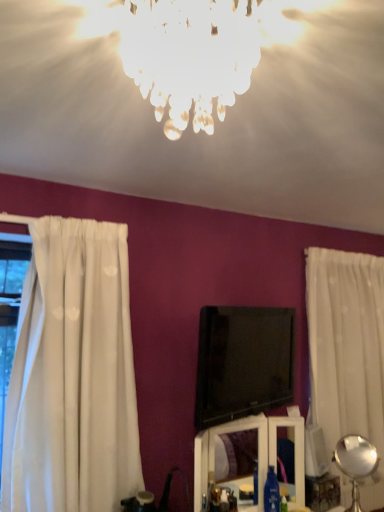
Question: From the image's perspective, would you say white glossy vanity at lower center is shown under white sheer curtain at right?

Choices:
 (A) yes
 (B) no

Answer: (A)

Question: Considering the relative sizes of white glossy vanity at lower center and white sheer curtain at right in the image provided, is white glossy vanity at lower center smaller than white sheer curtain at right?

Choices:
 (A) yes
 (B) no

Answer: (A)

Question: Can you confirm if white glossy vanity at lower center is wider than white sheer curtain at right?

Choices:
 (A) no
 (B) yes

Answer: (A)

Question: From a real-world perspective, is white glossy vanity at lower center over white sheer curtain at right?

Choices:
 (A) yes
 (B) no

Answer: (B)

Question: Is white glossy vanity at lower center to the left of white sheer curtain at right from the viewer's perspective?

Choices:
 (A) no
 (B) yes

Answer: (B)

Question: Is there a large distance between white glossy vanity at lower center and white sheer curtain at right?

Choices:
 (A) no
 (B) yes

Answer: (A)

Question: Is metallic silver lamp at lower right, acting as the 1th lamp starting from the bottom, turned away from icy glass chandelier at upper center, which ranks as the second lamp in bottom-to-top order?

Choices:
 (A) no
 (B) yes

Answer: (A)

Question: Does metallic silver lamp at lower right, positioned as the first lamp in back-to-front order, have a lesser width compared to icy glass chandelier at upper center, which appears as the 1th lamp when viewed from the top?

Choices:
 (A) yes
 (B) no

Answer: (A)

Question: From the image's perspective, is metallic silver lamp at lower right, positioned as the first lamp in back-to-front order, located above icy glass chandelier at upper center, which appears as the 1th lamp when viewed from the top?

Choices:
 (A) no
 (B) yes

Answer: (A)

Question: Is metallic silver lamp at lower right, arranged as the second lamp when viewed from the left, further to camera compared to icy glass chandelier at upper center, the first lamp viewed from the front?

Choices:
 (A) yes
 (B) no

Answer: (A)

Question: Can you confirm if metallic silver lamp at lower right, the second lamp viewed from the top, is wider than icy glass chandelier at upper center, the 2th lamp in the back-to-front sequence?

Choices:
 (A) yes
 (B) no

Answer: (B)

Question: Can you confirm if metallic silver lamp at lower right, marked as the second lamp in a front-to-back arrangement, is bigger than icy glass chandelier at upper center, the 2th lamp in the back-to-front sequence?

Choices:
 (A) no
 (B) yes

Answer: (A)

Question: Considering the relative sizes of white glossy vanity at lower center and icy glass chandelier at upper center, which ranks as the second lamp in bottom-to-top order, in the image provided, is white glossy vanity at lower center taller than icy glass chandelier at upper center, which ranks as the second lamp in bottom-to-top order,?

Choices:
 (A) no
 (B) yes

Answer: (B)